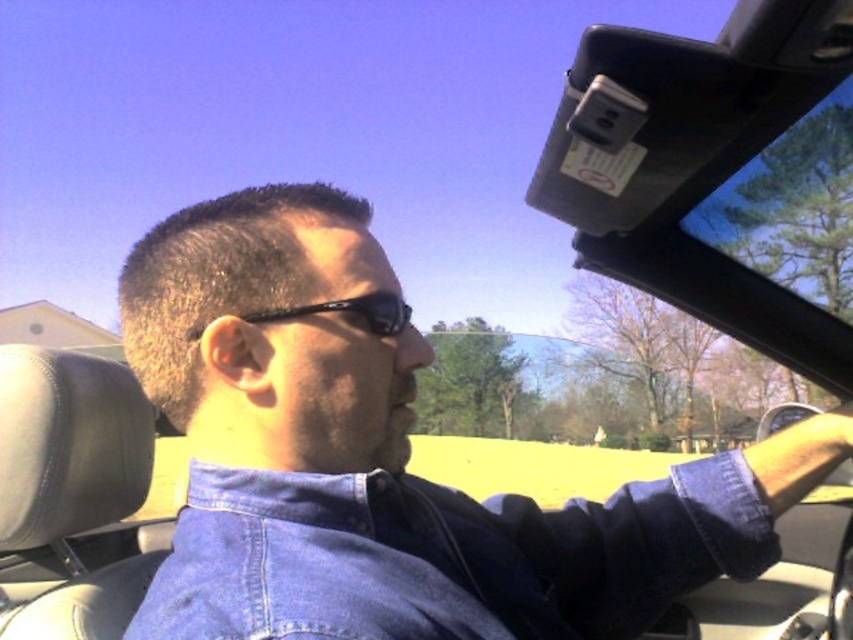
Can you confirm if faded denim jacket at lower right is thinner than metallic gray rearview mirror at upper right?

Yes, faded denim jacket at lower right is thinner than metallic gray rearview mirror at upper right.

Is point (212, 470) positioned in front of point (766, 420)?

Yes, it is.

This screenshot has height=640, width=853. What do you see at coordinates (445, 556) in the screenshot?
I see `faded denim jacket at lower right` at bounding box center [445, 556].

I want to click on faded denim jacket at lower right, so click(445, 556).

Which is behind, point (375, 321) or point (799, 417)?

Point (799, 417)

Can you confirm if black reflective sunglasses at center is smaller than metallic gray rearview mirror at upper right?

Yes, black reflective sunglasses at center is smaller than metallic gray rearview mirror at upper right.

Which is in front, point (363, 305) or point (770, 435)?

Positioned in front is point (363, 305).

Identify the location of black reflective sunglasses at center. This screenshot has width=853, height=640. (350, 310).

Does faded denim jacket at lower right appear on the left side of black reflective sunglasses at center?

In fact, faded denim jacket at lower right is to the right of black reflective sunglasses at center.

Is faded denim jacket at lower right taller than black reflective sunglasses at center?

Yes, faded denim jacket at lower right is taller than black reflective sunglasses at center.

Is point (728, 515) behind point (407, 312)?

Yes, point (728, 515) is farther from viewer.

Locate an element on the screen. The width and height of the screenshot is (853, 640). faded denim jacket at lower right is located at coordinates (x=445, y=556).